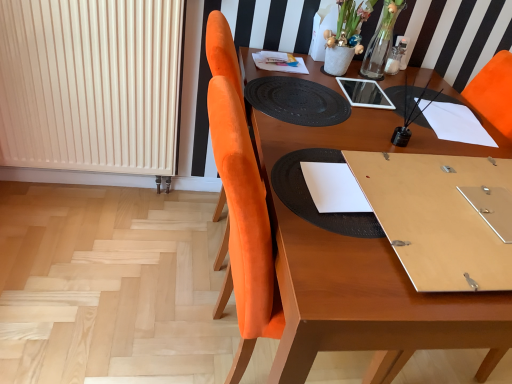
In order to click on unoccupied region to the right of white paper at center in this screenshot , I will do `click(408, 195)`.